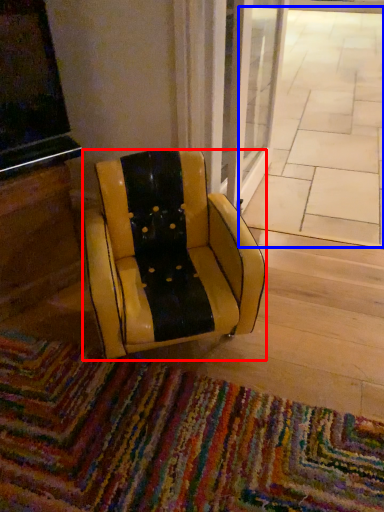
Question: Which of the following is the closest to the observer, chair (highlighted by a red box) or pavement (highlighted by a blue box)?

Choices:
 (A) chair
 (B) pavement

Answer: (A)